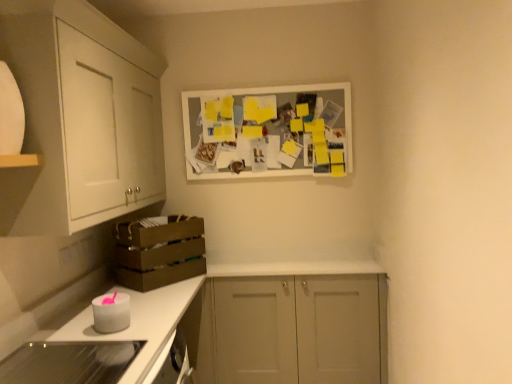
This screenshot has width=512, height=384. Identify the location of blank space situated above white matte picture frame at upper center (from a real-world perspective). (265, 85).